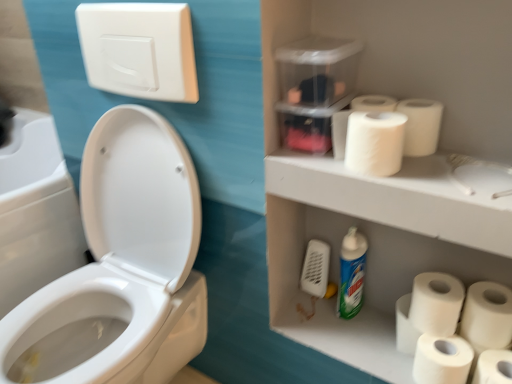
This screenshot has width=512, height=384. What do you see at coordinates (351, 273) in the screenshot?
I see `white glossy cleaning product at lower center` at bounding box center [351, 273].

Measure the distance between white matte toilet paper at upper right, which appears as the 2th toilet paper when viewed from the top, and camera.

white matte toilet paper at upper right, which appears as the 2th toilet paper when viewed from the top, and camera are 28.18 inches apart from each other.

Where is `white matte toilet paper at lower right, positioned as the 4th toilet paper in top-to-bottom order`? The height and width of the screenshot is (384, 512). white matte toilet paper at lower right, positioned as the 4th toilet paper in top-to-bottom order is located at coordinates pyautogui.click(x=487, y=316).

The image size is (512, 384). Identify the location of transparent plastic toiletry box at upper center. (315, 88).

The width and height of the screenshot is (512, 384). Describe the element at coordinates (442, 359) in the screenshot. I see `white matte toilet paper at lower right, acting as the second toilet paper starting from the bottom` at that location.

Where is `white glossy toilet at left`? Image resolution: width=512 pixels, height=384 pixels. white glossy toilet at left is located at coordinates (121, 268).

Locate an element on the screen. white glossy cleaning product at lower center is located at coordinates (351, 273).

Is transparent plastic toiletry box at upper center far away from white matte toilet paper at lower right, the sixth toilet paper in the top-to-bottom sequence?

Actually, transparent plastic toiletry box at upper center and white matte toilet paper at lower right, the sixth toilet paper in the top-to-bottom sequence, are a little close together.

Is transparent plastic toiletry box at upper center to the left of white matte toilet paper at lower right, the sixth toilet paper in the top-to-bottom sequence, from the viewer's perspective?

Indeed, transparent plastic toiletry box at upper center is positioned on the left side of white matte toilet paper at lower right, the sixth toilet paper in the top-to-bottom sequence.

In the scene shown: Can we say transparent plastic toiletry box at upper center lies outside white matte toilet paper at lower right, which ranks as the first toilet paper in bottom-to-top order?

transparent plastic toiletry box at upper center lies outside white matte toilet paper at lower right, which ranks as the first toilet paper in bottom-to-top order,'s area.

Is transparent plastic toiletry box at upper center aimed at white matte toilet paper at lower right, the sixth toilet paper in the top-to-bottom sequence?

No, transparent plastic toiletry box at upper center does not turn towards white matte toilet paper at lower right, the sixth toilet paper in the top-to-bottom sequence.

Is white matte toilet paper at lower right, which ranks as the first toilet paper in bottom-to-top order, closer to the viewer compared to white matte toilet paper at upper right, which ranks as the sixth toilet paper in bottom-to-top order?

Yes.

Between white matte toilet paper at lower right, which ranks as the first toilet paper in bottom-to-top order, and white matte toilet paper at upper right, the 1th toilet paper from the top, which one has larger size?

white matte toilet paper at lower right, which ranks as the first toilet paper in bottom-to-top order.

Which is less distant, [511,380] or [420,109]?

The point [420,109] is closer.

Looking at this image, is white glossy cleaning product at lower center completely or partially inside transparent plastic toiletry box at upper center?

That's incorrect, white glossy cleaning product at lower center is not inside transparent plastic toiletry box at upper center.

From a real-world perspective, is transparent plastic toiletry box at upper center beneath white glossy cleaning product at lower center?

No, from a real-world perspective, transparent plastic toiletry box at upper center is not below white glossy cleaning product at lower center.

Is transparent plastic toiletry box at upper center far away from white glossy cleaning product at lower center?

They are positioned close to each other.

How many degrees apart are the facing directions of transparent plastic toiletry box at upper center and white glossy cleaning product at lower center?

transparent plastic toiletry box at upper center and white glossy cleaning product at lower center are facing 0.00028 degrees away from each other.

Looking at the image, does white matte toilet paper at lower right, the 5th toilet paper when ordered from top to bottom, seem bigger or smaller compared to transparent plastic toiletry box at upper center?

Considering their sizes, white matte toilet paper at lower right, the 5th toilet paper when ordered from top to bottom, takes up less space than transparent plastic toiletry box at upper center.

In the image, is white matte toilet paper at lower right, acting as the second toilet paper starting from the bottom, positioned in front of or behind transparent plastic toiletry box at upper center?

Clearly, white matte toilet paper at lower right, acting as the second toilet paper starting from the bottom, is behind transparent plastic toiletry box at upper center.

From the image's perspective, which one is positioned lower, white matte toilet paper at lower right, acting as the second toilet paper starting from the bottom, or transparent plastic toiletry box at upper center?

white matte toilet paper at lower right, acting as the second toilet paper starting from the bottom.

Can you tell me how much white matte toilet paper at lower right, acting as the second toilet paper starting from the bottom, and transparent plastic toiletry box at upper center differ in facing direction?

0.000861 degrees.

Is point (482, 352) closer to viewer compared to point (462, 374)?

No, it is not.

Is white matte toilet paper at lower right, the sixth toilet paper in the top-to-bottom sequence, looking in the opposite direction of white matte toilet paper at lower right, acting as the second toilet paper starting from the bottom?

No.

Is white matte toilet paper at lower right, which ranks as the first toilet paper in bottom-to-top order, far away from white matte toilet paper at lower right, the 5th toilet paper when ordered from top to bottom?

No, there isn't a large distance between white matte toilet paper at lower right, which ranks as the first toilet paper in bottom-to-top order, and white matte toilet paper at lower right, the 5th toilet paper when ordered from top to bottom.

Is the depth of white matte toilet paper at lower right, the sixth toilet paper in the top-to-bottom sequence, greater than that of white matte toilet paper at lower right, acting as the second toilet paper starting from the bottom?

No, the depth of white matte toilet paper at lower right, the sixth toilet paper in the top-to-bottom sequence, is less than that of white matte toilet paper at lower right, acting as the second toilet paper starting from the bottom.

Looking at their sizes, would you say transparent plastic toiletry box at upper center is wider or thinner than white matte toilet paper at lower right, the 3th toilet paper when ordered from top to bottom?

In the image, transparent plastic toiletry box at upper center appears to be wider than white matte toilet paper at lower right, the 3th toilet paper when ordered from top to bottom.

Between transparent plastic toiletry box at upper center and white matte toilet paper at lower right, which appears as the fourth toilet paper when ordered from the bottom, which one has less height?

white matte toilet paper at lower right, which appears as the fourth toilet paper when ordered from the bottom.

Find the location of a particular element. Image resolution: width=512 pixels, height=384 pixels. toilet paper that is the 4th one below the transparent plastic toiletry box at upper center (from a real-world perspective) is located at coordinates (436, 303).

Is white matte toilet paper at lower right, which appears as the fourth toilet paper when ordered from the bottom, taller or shorter than white matte toilet paper at upper right, which ranks as the sixth toilet paper in bottom-to-top order?

Considering their sizes, white matte toilet paper at lower right, which appears as the fourth toilet paper when ordered from the bottom, has more height than white matte toilet paper at upper right, which ranks as the sixth toilet paper in bottom-to-top order.

In the scene shown: Which object is closer to the camera taking this photo, white matte toilet paper at lower right, the 3th toilet paper when ordered from top to bottom, or white matte toilet paper at upper right, which ranks as the sixth toilet paper in bottom-to-top order?

white matte toilet paper at upper right, which ranks as the sixth toilet paper in bottom-to-top order, is in front.

Can you confirm if white matte toilet paper at lower right, which appears as the fourth toilet paper when ordered from the bottom, is positioned to the right of white matte toilet paper at upper right, which ranks as the sixth toilet paper in bottom-to-top order?

Correct, you'll find white matte toilet paper at lower right, which appears as the fourth toilet paper when ordered from the bottom, to the right of white matte toilet paper at upper right, which ranks as the sixth toilet paper in bottom-to-top order.

Which toilet paper is the 1st one when counting from the back of the transparent plastic toiletry box at upper center? Please provide its 2D coordinates.

[(494, 367)]

The width and height of the screenshot is (512, 384). I want to click on toilet paper that is the 3rd object to the right of the white matte toilet paper at upper right, which ranks as the sixth toilet paper in bottom-to-top order, starting at the anchor, so click(494, 367).

When comparing their distances from white matte toilet paper at lower right, the sixth toilet paper in the top-to-bottom sequence, does white glossy toilet at left or transparent plastic toiletry box at upper center seem closer?

Based on the image, transparent plastic toiletry box at upper center appears to be nearer to white matte toilet paper at lower right, the sixth toilet paper in the top-to-bottom sequence.

From the image, which object appears to be farther from white glossy cleaning product at lower center, transparent plastic toiletry box at upper center or white matte toilet paper at lower right, the 3th toilet paper when ordered from top to bottom?

transparent plastic toiletry box at upper center is further to white glossy cleaning product at lower center.

Considering their positions, is white matte toilet paper at lower right, the 3th toilet paper when ordered from top to bottom, positioned further to white matte toilet paper at lower right, the sixth toilet paper in the top-to-bottom sequence, than white matte toilet paper at upper right, which appears as the 2th toilet paper when viewed from the top?

white matte toilet paper at upper right, which appears as the 2th toilet paper when viewed from the top, is positioned further to the anchor white matte toilet paper at lower right, the sixth toilet paper in the top-to-bottom sequence.

Considering their positions, is white matte toilet paper at upper right, which appears as the 2th toilet paper when viewed from the top, positioned further to white glossy toilet at left than white matte toilet paper at lower right, the sixth toilet paper in the top-to-bottom sequence?

white matte toilet paper at lower right, the sixth toilet paper in the top-to-bottom sequence, is positioned further to the anchor white glossy toilet at left.

Based on their spatial positions, is white matte toilet paper at upper right, which ranks as the sixth toilet paper in bottom-to-top order, or white glossy cleaning product at lower center closer to white matte toilet paper at lower right, the 3th toilet paper when ordered from top to bottom?

The object closer to white matte toilet paper at lower right, the 3th toilet paper when ordered from top to bottom, is white glossy cleaning product at lower center.

Which object lies nearer to the anchor point white matte toilet paper at lower right, acting as the second toilet paper starting from the bottom, white matte toilet paper at lower right, the sixth toilet paper in the top-to-bottom sequence, or transparent plastic toiletry box at upper center?

Based on the image, white matte toilet paper at lower right, the sixth toilet paper in the top-to-bottom sequence, appears to be nearer to white matte toilet paper at lower right, acting as the second toilet paper starting from the bottom.

Considering their positions, is transparent plastic toiletry box at upper center positioned closer to white matte toilet paper at upper right, which appears as the 2th toilet paper when viewed from the top, than white matte toilet paper at lower right, which ranks as the first toilet paper in bottom-to-top order?

transparent plastic toiletry box at upper center lies closer to white matte toilet paper at upper right, which appears as the 2th toilet paper when viewed from the top, than the other object.

Estimate the real-world distances between objects in this image. Which object is further from white matte toilet paper at lower right, the 3th toilet paper ordered from the bottom, white matte toilet paper at upper right, which ranks as the sixth toilet paper in bottom-to-top order, or white glossy cleaning product at lower center?

Among the two, white matte toilet paper at upper right, which ranks as the sixth toilet paper in bottom-to-top order, is located further to white matte toilet paper at lower right, the 3th toilet paper ordered from the bottom.

Where is `cleaning product located between white glossy toilet at left and white matte toilet paper at upper right, which ranks as the sixth toilet paper in bottom-to-top order, in the left-right direction`? This screenshot has height=384, width=512. cleaning product located between white glossy toilet at left and white matte toilet paper at upper right, which ranks as the sixth toilet paper in bottom-to-top order, in the left-right direction is located at coordinates (351, 273).

Locate an element on the screen. cleaning product between white glossy toilet at left and white matte toilet paper at lower right, the 3th toilet paper when ordered from top to bottom, from left to right is located at coordinates (351, 273).

The image size is (512, 384). I want to click on paper towel between white glossy toilet at left and white matte toilet paper at upper right, which ranks as the sixth toilet paper in bottom-to-top order, in the horizontal direction, so click(x=353, y=111).

Locate an element on the screen. toilet paper between white matte toilet paper at lower right, the 3th toilet paper when ordered from top to bottom, and white matte toilet paper at lower right, acting as the second toilet paper starting from the bottom, vertically is located at coordinates (487, 316).